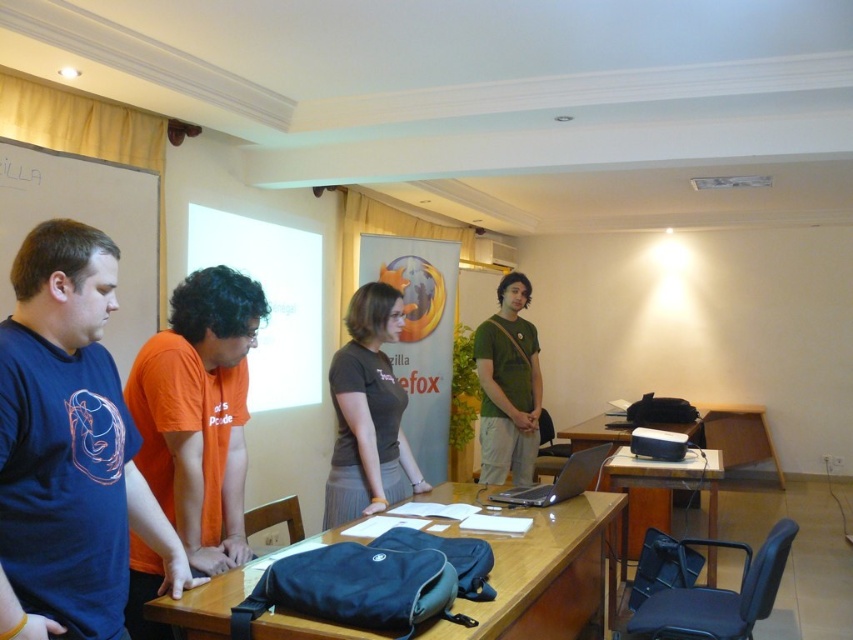
Question: From the image, what is the correct spatial relationship of blue fabric bag at center in relation to matte gray shirt at center?

Choices:
 (A) right
 (B) left

Answer: (A)

Question: Based on their relative distances, which object is nearer to the matte blue t-shirt at left?

Choices:
 (A) satin silver laptop at center
 (B) matte gray shirt at center

Answer: (B)

Question: Is matte blue t-shirt at left positioned in front of matte black table at lower right?

Choices:
 (A) yes
 (B) no

Answer: (A)

Question: Is green matte shirt at center further to camera compared to satin silver laptop at center?

Choices:
 (A) no
 (B) yes

Answer: (B)

Question: Estimate the real-world distances between objects in this image. Which object is closer to the satin silver laptop at center?

Choices:
 (A) blue fabric bag at center
 (B) matte blue t-shirt at left

Answer: (A)

Question: Which is farther from the green matte shirt at center?

Choices:
 (A) matte gray shirt at center
 (B) matte black table at lower right
 (C) satin silver laptop at center

Answer: (A)